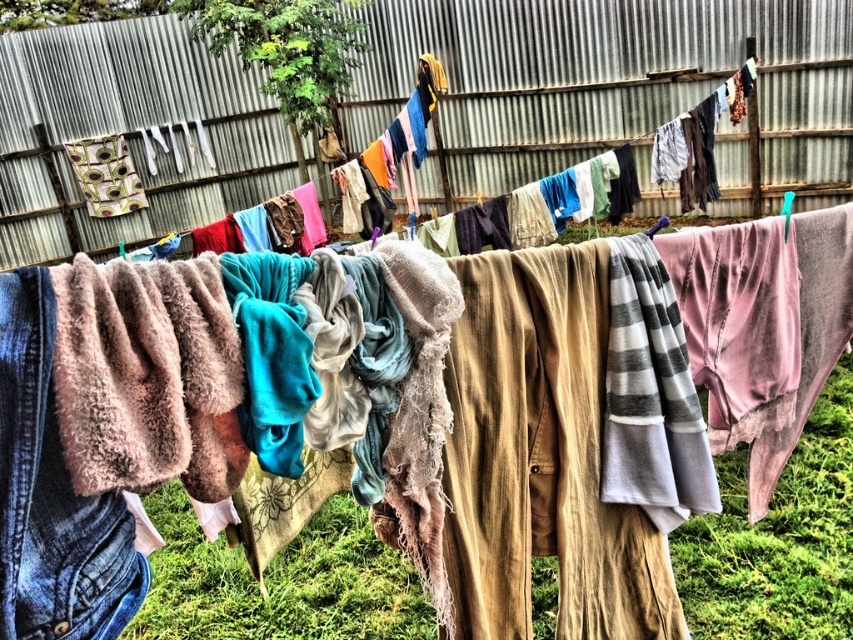
Image resolution: width=853 pixels, height=640 pixels. What do you see at coordinates (611, 92) in the screenshot?
I see `metallic corrugated fence at upper center` at bounding box center [611, 92].

Can you confirm if metallic corrugated fence at upper center is wider than denim at left?

Correct, the width of metallic corrugated fence at upper center exceeds that of denim at left.

Is point (834, 177) less distant than point (44, 344)?

No.

Locate an element on the screen. metallic corrugated fence at upper center is located at coordinates (611, 92).

Describe the element at coordinates (280, 566) in the screenshot. I see `fuzzy beige blanket at center` at that location.

Between fuzzy beige blanket at center and denim at left, which one appears on the right side from the viewer's perspective?

fuzzy beige blanket at center is more to the right.

This screenshot has height=640, width=853. I want to click on fuzzy beige blanket at center, so pos(280,566).

Who is higher up, metallic corrugated fence at upper center or fuzzy beige blanket at center?

metallic corrugated fence at upper center

Is metallic corrugated fence at upper center below fuzzy beige blanket at center?

Actually, metallic corrugated fence at upper center is above fuzzy beige blanket at center.

Is point (107, 253) behind point (200, 600)?

Yes, it is behind point (200, 600).

Identify the location of metallic corrugated fence at upper center. (611, 92).